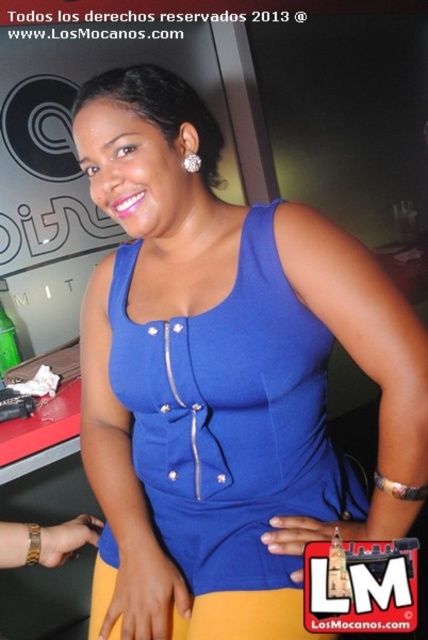
Does point (246, 298) come farther from viewer compared to point (193, 157)?

That is False.

Can you confirm if blue fabric dress at center is positioned below diamondelegantearring at upper left?

Yes.

The height and width of the screenshot is (640, 428). Describe the element at coordinates (231, 419) in the screenshot. I see `blue fabric dress at center` at that location.

This screenshot has width=428, height=640. What are the coordinates of `blue fabric dress at center` in the screenshot? It's located at (231, 419).

Between blue fabric dress at center and green glass bottle at left, which one is positioned lower?

blue fabric dress at center is below.

Does blue fabric dress at center have a lesser width compared to green glass bottle at left?

No, blue fabric dress at center is not thinner than green glass bottle at left.

Image resolution: width=428 pixels, height=640 pixels. Find the location of `blue fabric dress at center`. blue fabric dress at center is located at coordinates tap(231, 419).

This screenshot has height=640, width=428. What are the coordinates of `blue fabric dress at center` in the screenshot? It's located at coord(231,419).

Can you confirm if green glass bottle at left is smaller than diamondelegantearring at upper left?

Incorrect, green glass bottle at left is not smaller in size than diamondelegantearring at upper left.

Is green glass bottle at left further to the viewer compared to diamondelegantearring at upper left?

Yes, green glass bottle at left is further from the viewer.

Which is in front, point (5, 349) or point (196, 156)?

Point (196, 156) is in front.

You are a GUI agent. You are given a task and a screenshot of the screen. Output one action in this format:
    pyautogui.click(x=<x>, y=<y>)
    Task: Click on the green glass bottle at left
    
    Given the screenshot: What is the action you would take?
    pyautogui.click(x=8, y=342)